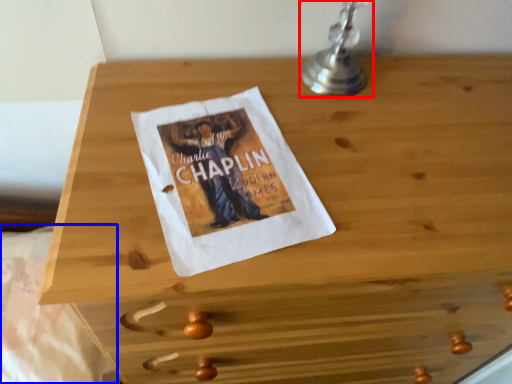
Question: Among these objects, which one is farthest to the camera, table lamp (highlighted by a red box) or sheet (highlighted by a blue box)?

Choices:
 (A) table lamp
 (B) sheet

Answer: (B)